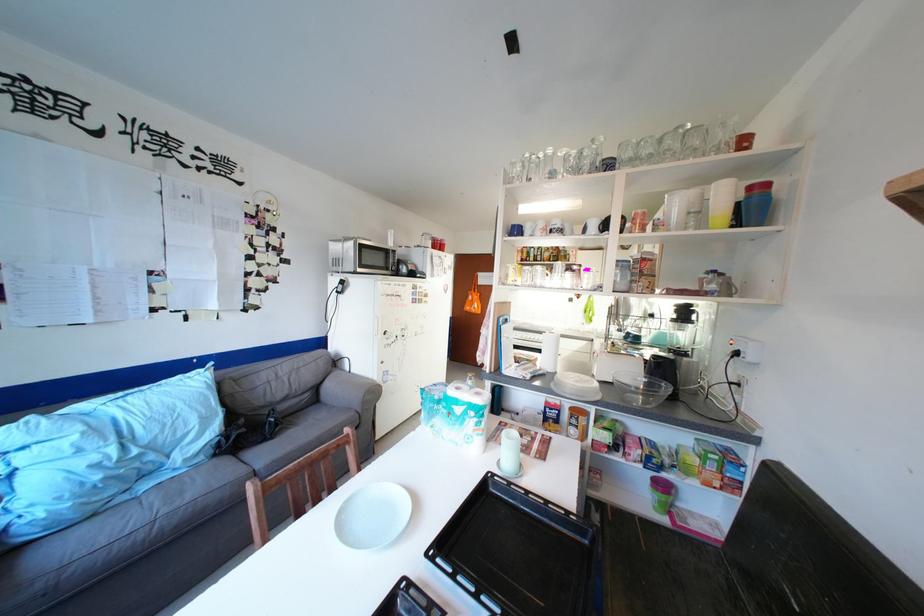
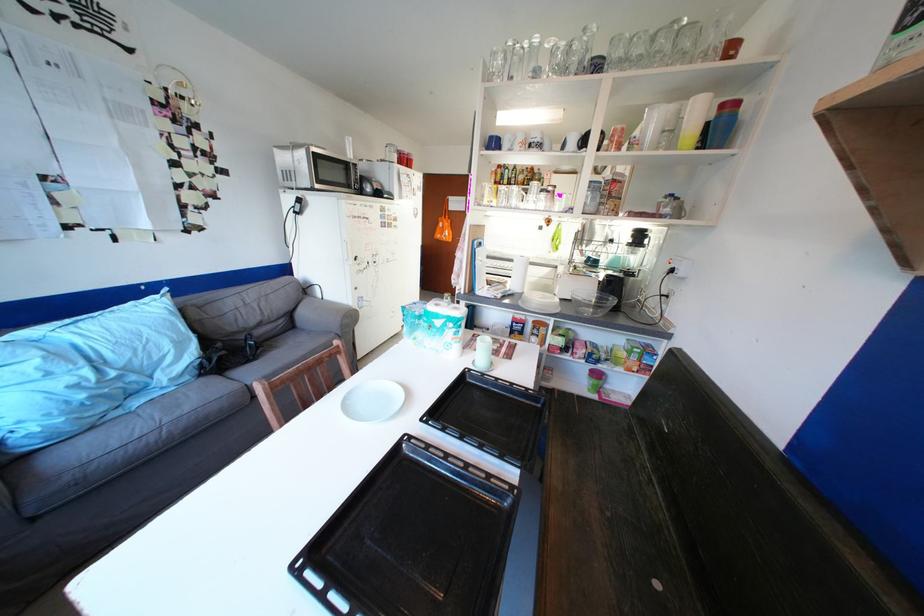
The point at (616, 167) is marked in the first image. Where is the corresponding point in the second image?

(604, 68)